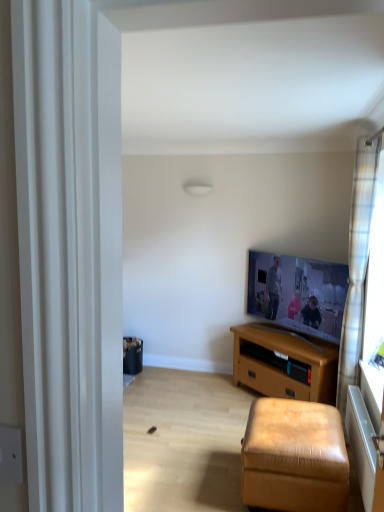
Question: From the image's perspective, does brown wooden tv stand at center appear lower than plaid fabric curtain at right?

Choices:
 (A) no
 (B) yes

Answer: (B)

Question: Is brown wooden tv stand at center shorter than plaid fabric curtain at right?

Choices:
 (A) no
 (B) yes

Answer: (B)

Question: From a real-world perspective, is brown wooden tv stand at center located beneath plaid fabric curtain at right?

Choices:
 (A) yes
 (B) no

Answer: (A)

Question: Is plaid fabric curtain at right at the back of brown wooden tv stand at center?

Choices:
 (A) yes
 (B) no

Answer: (B)

Question: From a real-world perspective, is brown wooden tv stand at center over plaid fabric curtain at right?

Choices:
 (A) no
 (B) yes

Answer: (A)

Question: From a real-world perspective, is leather-like stool at lower right above or below plaid fabric curtain at right?

Choices:
 (A) above
 (B) below

Answer: (B)

Question: Looking at their shapes, would you say leather-like stool at lower right is wider or thinner than plaid fabric curtain at right?

Choices:
 (A) thin
 (B) wide

Answer: (B)

Question: From their relative heights in the image, would you say leather-like stool at lower right is taller or shorter than plaid fabric curtain at right?

Choices:
 (A) short
 (B) tall

Answer: (A)

Question: From the image's perspective, relative to plaid fabric curtain at right, is leather-like stool at lower right above or below?

Choices:
 (A) below
 (B) above

Answer: (A)

Question: Is point (288, 431) closer or farther from the camera than point (324, 304)?

Choices:
 (A) closer
 (B) farther

Answer: (A)

Question: Relative to flat screen tv at upper right, is leather-like stool at lower right in front or behind?

Choices:
 (A) front
 (B) behind

Answer: (A)

Question: Based on their positions, is leather-like stool at lower right located to the left or right of flat screen tv at upper right?

Choices:
 (A) right
 (B) left

Answer: (B)

Question: Considering the positions of leather-like stool at lower right and flat screen tv at upper right in the image, is leather-like stool at lower right bigger or smaller than flat screen tv at upper right?

Choices:
 (A) big
 (B) small

Answer: (A)

Question: Is point (354, 167) closer or farther from the camera than point (316, 497)?

Choices:
 (A) farther
 (B) closer

Answer: (A)

Question: Considering the positions of plaid fabric curtain at right and leather-like stool at lower right in the image, is plaid fabric curtain at right wider or thinner than leather-like stool at lower right?

Choices:
 (A) thin
 (B) wide

Answer: (A)